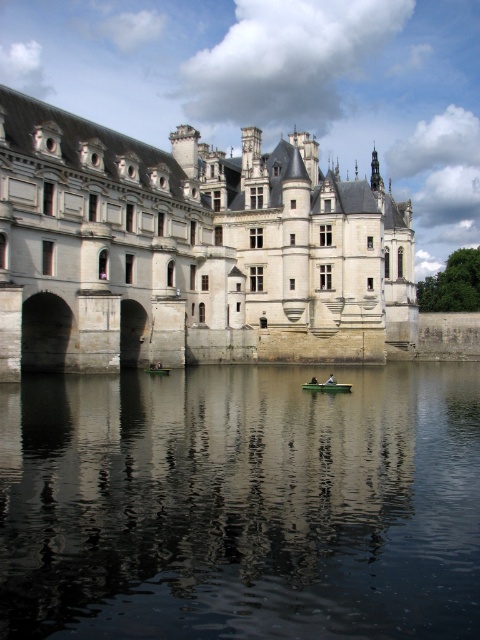
In the scene shown: Can you confirm if green plastic boat at center is taller than green fabric boat at center?

No.

Measure the distance between green plastic boat at center and camera.

They are 214.82 feet apart.

Between point (305, 387) and point (333, 374), which one is positioned behind?

The point (333, 374) is more distant.

The image size is (480, 640). Identify the location of green plastic boat at center. (326, 387).

Can you confirm if dark reflective water at center is smaller than green plastic boat at center?

Incorrect, dark reflective water at center is not smaller in size than green plastic boat at center.

Looking at this image, is dark reflective water at center above green plastic boat at center?

Actually, dark reflective water at center is below green plastic boat at center.

This screenshot has width=480, height=640. What do you see at coordinates (240, 504) in the screenshot?
I see `dark reflective water at center` at bounding box center [240, 504].

At what (x,y) coordinates should I click in order to perform the action: click on dark reflective water at center. Please return your answer as a coordinate pair (x, y). Looking at the image, I should click on (240, 504).

Is dark reflective water at center positioned behind white stone castle at center?

No, it is not.

Identify the location of dark reflective water at center. The image size is (480, 640). (240, 504).